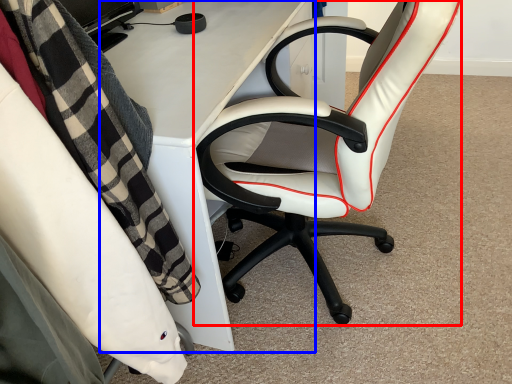
Question: Which object appears farthest to the camera in this image, chair (highlighted by a red box) or desk (highlighted by a blue box)?

Choices:
 (A) chair
 (B) desk

Answer: (B)